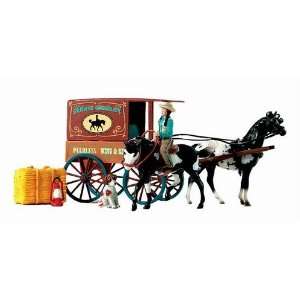
Find the location of a particular element. The width and height of the screenshot is (300, 300). shoe is located at coordinates (166, 169).